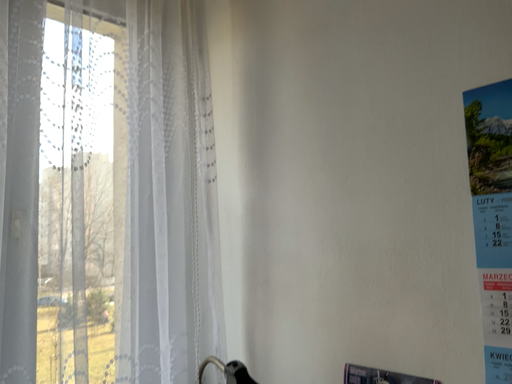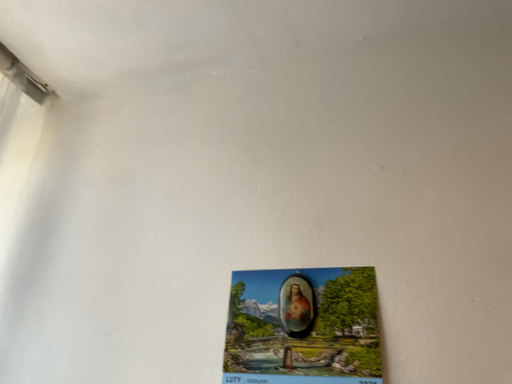
Question: Which way did the camera rotate in the video?

Choices:
 (A) rotated left
 (B) rotated right

Answer: (B)